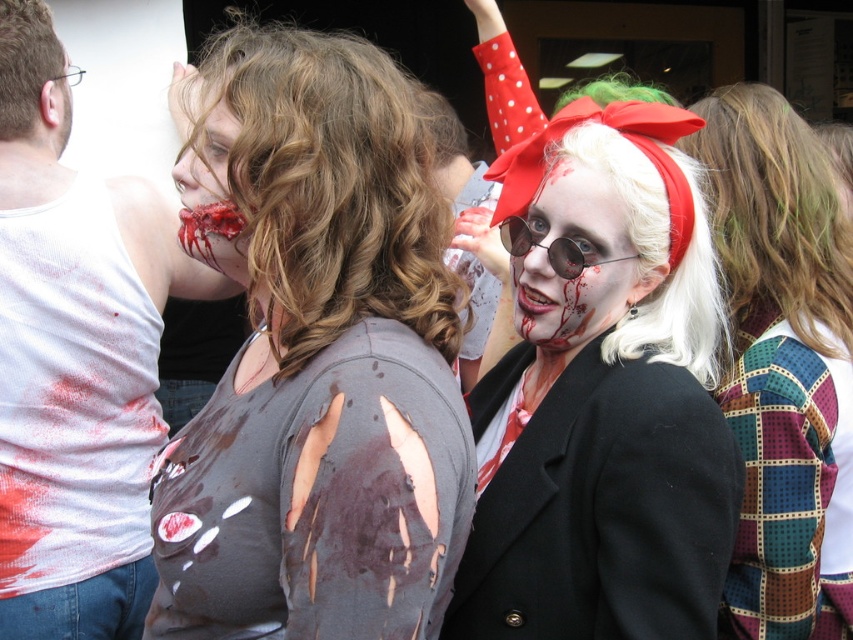
You are a photographer at the event and need to capture a closeup of the white matte wig at center and the bloodied skin at center. Which object should you focus on first if you want to ensure both are in frame without moving the camera?

The white matte wig at center occupies less space than bloodied skin at center, so you should focus on the bloodied skin at center first as it is larger and will require more attention to fit within the frame.

You are a photographer trying to capture a closeup of the matte black coat at center and the multicolored patchwork scarf at upper right in the image. Which object should you zoom in on to ensure both are in frame without moving the camera?

The matte black coat at center is wider than the multicolored patchwork scarf at upper right, so you should zoom in on the matte black coat at center to ensure both are in frame without moving the camera.

You are a photographer trying to capture a closeup of the zombie woman on the left. You are currently positioned at point (590, 168). Which direction should you move to get closer to the zombie woman on the left at point (750, 516)?

To get closer to the zombie woman on the left at point (750, 516), you should move towards point (750, 516) from your current position at point (590, 168).